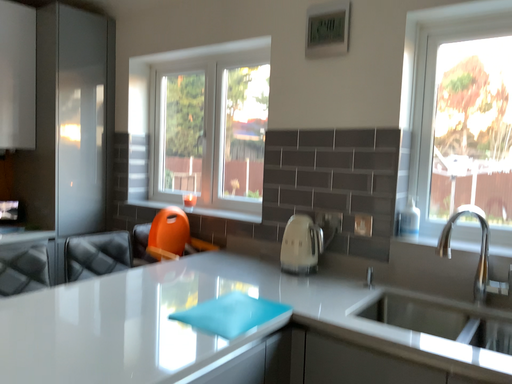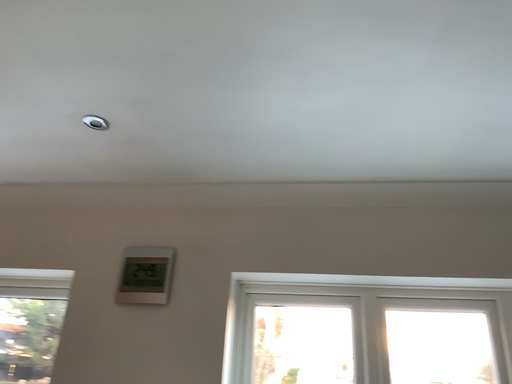
Question: How did the camera likely rotate when shooting the video?

Choices:
 (A) rotated upward
 (B) rotated downward

Answer: (A)